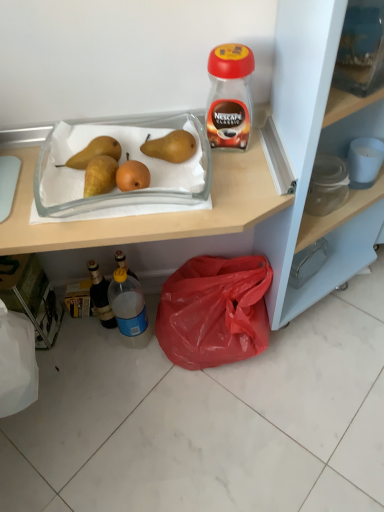
This screenshot has height=512, width=384. I want to click on free location to the left of translucent plastic bottle at lower left, acting as the first bottle starting from the right, so click(85, 353).